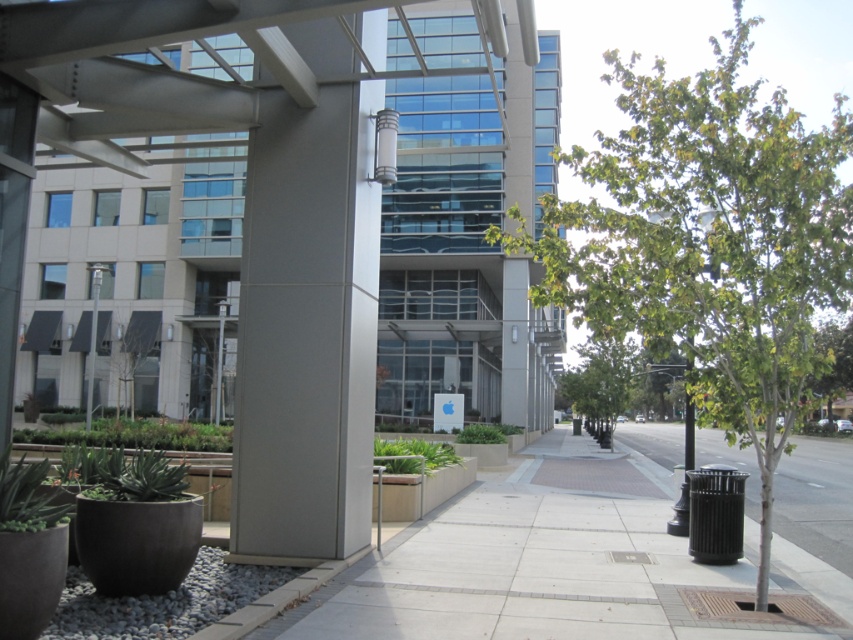
You are a maintenance worker tasked with watering plants in the urban area. You see the green matte planter at lower left and the green matte planter at center. Which planter requires more soil to fill it up to the brim?

The green matte planter at center requires more soil to fill it up to the brim because it has a greater height than the green matte planter at lower left.

You are standing at the camera position and want to place a new planter that is 3 feet wide next to the green matte planter at lower left. Can you fit it there without moving the existing planter?

The green matte planter at lower left is 42.76 feet away from camera. Since the new planter is only 3 feet wide, there should be sufficient space to place it next to the existing planter without moving it.

You are standing at the camera position and looking at the scene. There are two points marked in the image, one at coordinates point (720,161) and another at point (61,428). Which of these two points is nearer to your current position?

Point (720,161) is closer to the camera than point (61,428), so the point at coordinates point (720,161) is nearer to your current position.